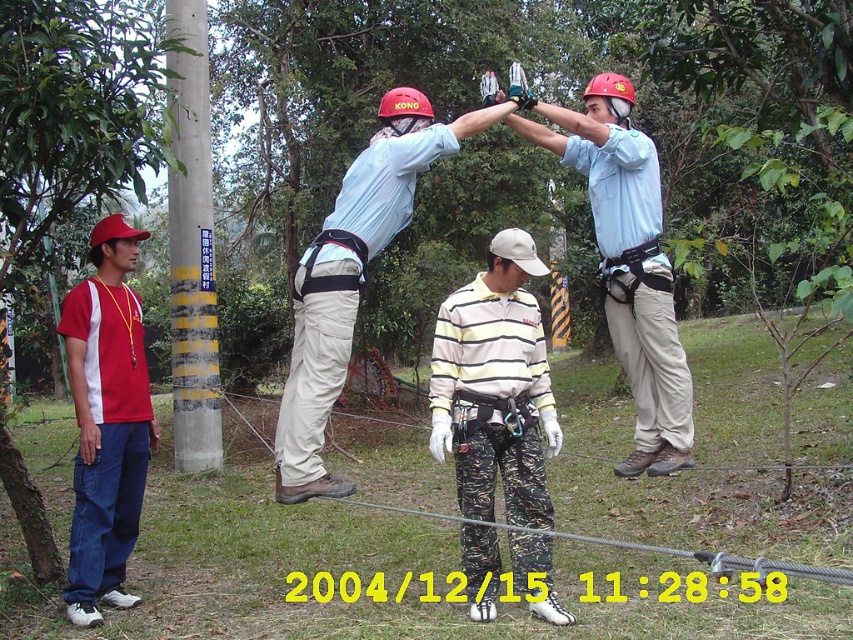
Which is more to the left, camouflage pants at center or light blue shirt at center?

camouflage pants at center is more to the left.

Does camouflage pants at center appear on the right side of light blue shirt at center?

Incorrect, camouflage pants at center is not on the right side of light blue shirt at center.

Image resolution: width=853 pixels, height=640 pixels. Find the location of `camouflage pants at center`. camouflage pants at center is located at coordinates (495, 387).

You are a GUI agent. You are given a task and a screenshot of the screen. Output one action in this format:
    pyautogui.click(x=<x>, y=<y>)
    Task: Click on the camouflage pants at center
    
    Given the screenshot: What is the action you would take?
    pyautogui.click(x=495, y=387)

Is light blue shirt at center taller than concrete pole at left?

In fact, light blue shirt at center may be shorter than concrete pole at left.

Can you confirm if light blue shirt at center is shorter than concrete pole at left?

A: Yes, light blue shirt at center is shorter than concrete pole at left.

Is point (663, 428) positioned behind point (201, 371)?

No, (663, 428) is closer to viewer.

The height and width of the screenshot is (640, 853). Find the location of `light blue shirt at center`. light blue shirt at center is located at coordinates point(627,262).

Is light blue shirt at center to the right of red cotton t-shirt at left from the viewer's perspective?

Correct, you'll find light blue shirt at center to the right of red cotton t-shirt at left.

Which of these two, light blue shirt at center or red cotton t-shirt at left, stands shorter?

light blue shirt at center is shorter.

Between point (672, 444) and point (138, 237), which one is positioned in front?

Point (672, 444) is more forward.

Where is `light blue shirt at center`? The height and width of the screenshot is (640, 853). light blue shirt at center is located at coordinates click(x=627, y=262).